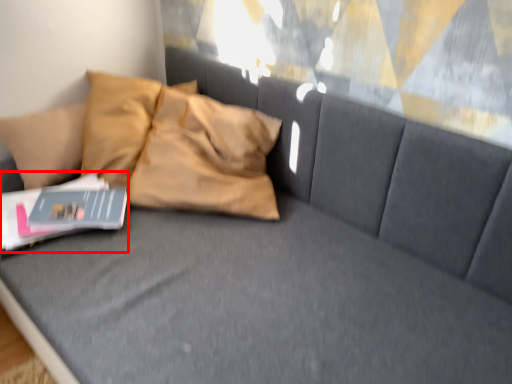
Question: Where is paperback book (annotated by the red box) located in relation to magazine in the image?

Choices:
 (A) left
 (B) right

Answer: (A)